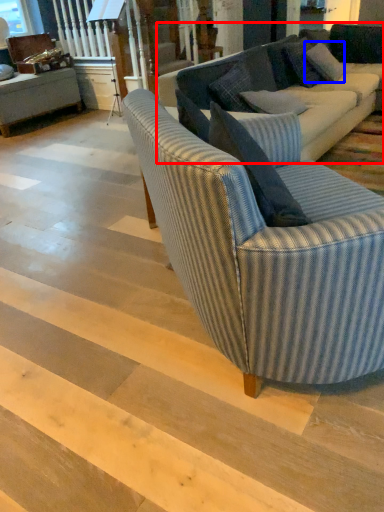
Question: Which object appears closest to the camera in this image, studio couch (highlighted by a red box) or pillow (highlighted by a blue box)?

Choices:
 (A) studio couch
 (B) pillow

Answer: (A)